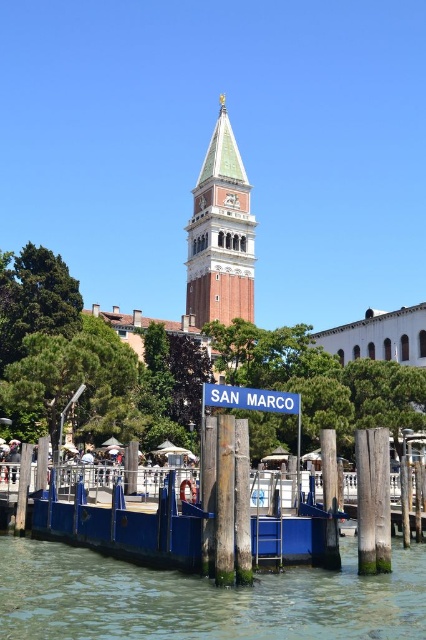
Is clear water at lower center smaller than green copper bell tower at center?

Correct, clear water at lower center occupies less space than green copper bell tower at center.

Is clear water at lower center positioned before green copper bell tower at center?

Yes, it is.

The width and height of the screenshot is (426, 640). Find the location of `clear water at lower center`. clear water at lower center is located at coordinates (203, 598).

Where is `clear water at lower center`? This screenshot has height=640, width=426. clear water at lower center is located at coordinates [203, 598].

What are the coordinates of `clear water at lower center` in the screenshot? It's located at (203, 598).

Does green copper bell tower at center appear under white plastic street sign at center?

Incorrect, green copper bell tower at center is not positioned below white plastic street sign at center.

This screenshot has width=426, height=640. What do you see at coordinates (221, 234) in the screenshot? I see `green copper bell tower at center` at bounding box center [221, 234].

Image resolution: width=426 pixels, height=640 pixels. What are the coordinates of `green copper bell tower at center` in the screenshot? It's located at (221, 234).